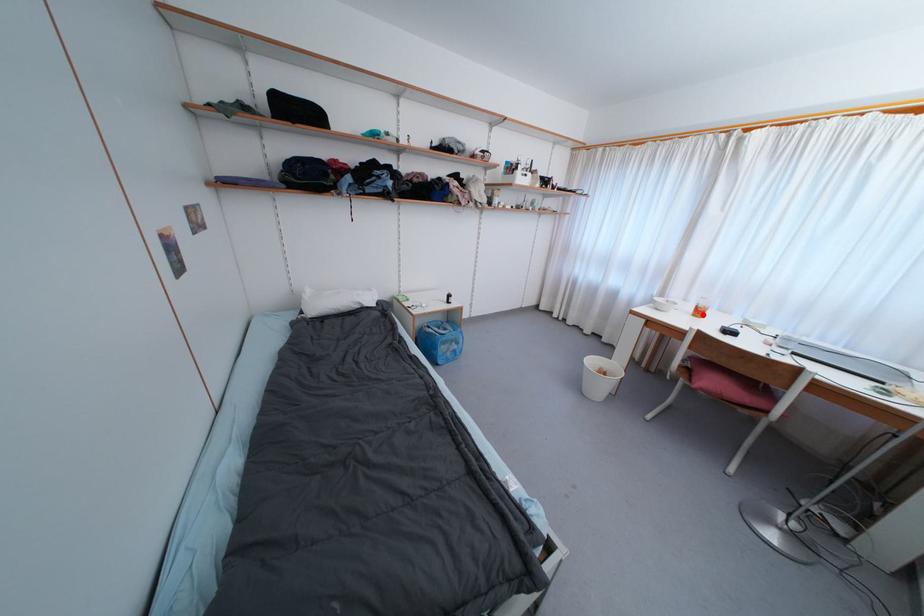
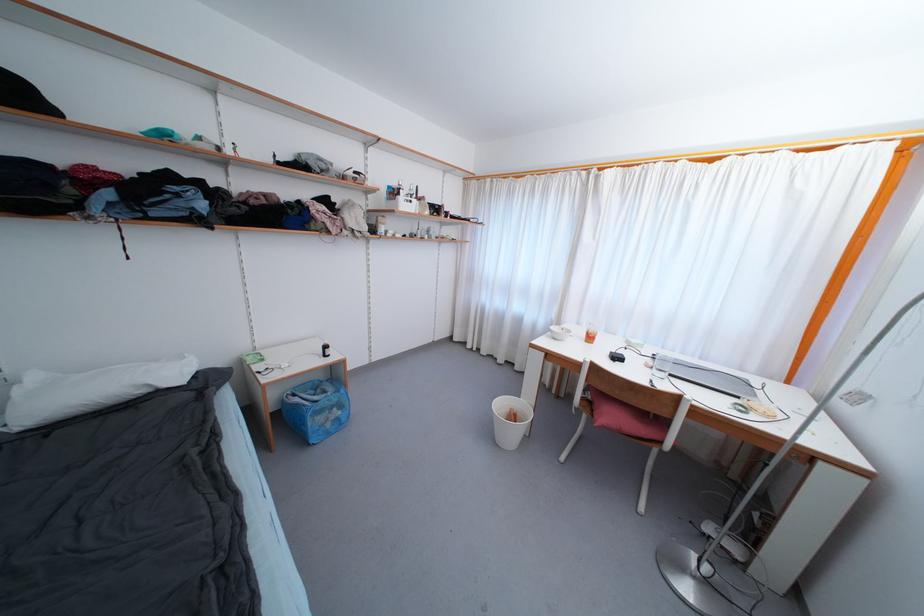
The point at the highlighted location is marked in the first image. Where is the corresponding point in the second image?

(593, 341)